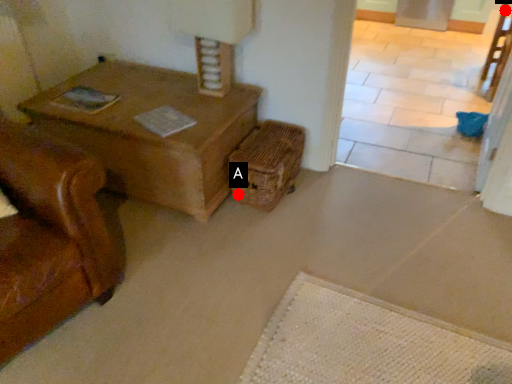
Question: Two points are circled on the image, labeled by A and B beside each circle. Which point appears closest to the camera in this image?

Choices:
 (A) A is closer
 (B) B is closer

Answer: (A)